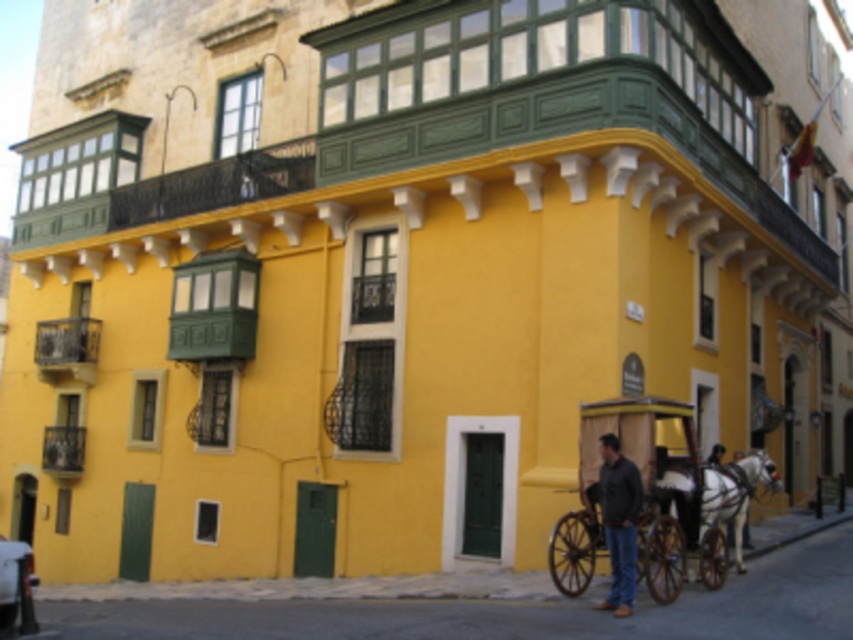
Which is behind, point (621, 593) or point (15, 600)?

Positioned behind is point (621, 593).

Can you confirm if matte brown wooden coach at lower right is shorter than metallic silver car at lower left?

Indeed, matte brown wooden coach at lower right has a lesser height compared to metallic silver car at lower left.

What are the coordinates of `matte brown wooden coach at lower right` in the screenshot? It's located at (619, 522).

Image resolution: width=853 pixels, height=640 pixels. I want to click on matte brown wooden coach at lower right, so click(x=619, y=522).

How far apart are wooden cart at lower right and matte brown wooden coach at lower right?

wooden cart at lower right and matte brown wooden coach at lower right are 3.34 feet apart from each other.

How much distance is there between wooden cart at lower right and matte brown wooden coach at lower right?

The distance of wooden cart at lower right from matte brown wooden coach at lower right is 3.34 feet.

Is point (570, 588) closer to viewer compared to point (637, 508)?

No.

At what (x,y) coordinates should I click in order to perform the action: click on wooden cart at lower right. Please return your answer as a coordinate pair (x, y). The width and height of the screenshot is (853, 640). Looking at the image, I should click on (642, 500).

How distant is wooden cart at lower right from white glossy horse at lower right?

wooden cart at lower right and white glossy horse at lower right are 6.70 feet apart.

Looking at this image, does wooden cart at lower right appear on the right side of white glossy horse at lower right?

Incorrect, wooden cart at lower right is not on the right side of white glossy horse at lower right.

This screenshot has width=853, height=640. What do you see at coordinates (642, 500) in the screenshot?
I see `wooden cart at lower right` at bounding box center [642, 500].

I want to click on wooden cart at lower right, so click(x=642, y=500).